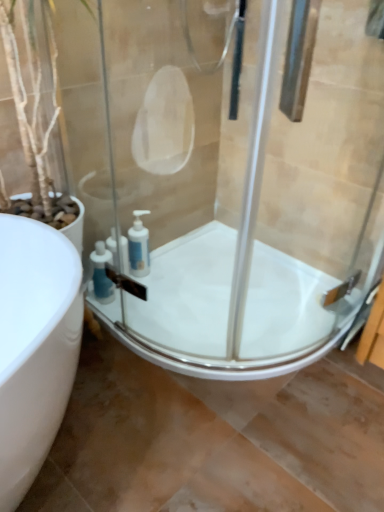
The width and height of the screenshot is (384, 512). Find the location of `free space in front of blue plastic soap dispenser at lower center, the 1th soap dispenser in the left-to-right sequence`. free space in front of blue plastic soap dispenser at lower center, the 1th soap dispenser in the left-to-right sequence is located at coordinates (x=107, y=328).